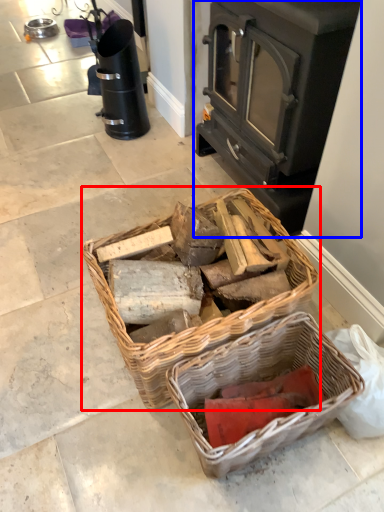
Question: Which point is further to the camera, picnic basket (highlighted by a red box) or wood burning stove (highlighted by a blue box)?

Choices:
 (A) picnic basket
 (B) wood burning stove

Answer: (B)